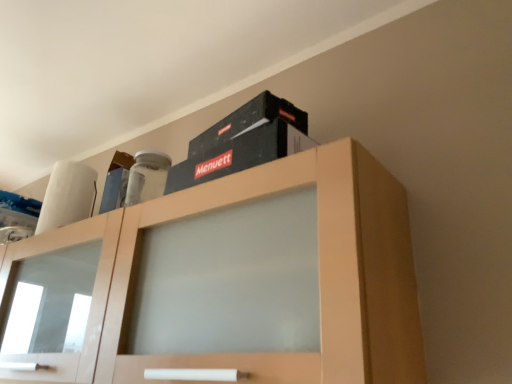
Where is `matte wood cabinet at upper center`? Image resolution: width=512 pixels, height=384 pixels. matte wood cabinet at upper center is located at coordinates (320, 262).

What do you see at coordinates (320, 262) in the screenshot? I see `matte wood cabinet at upper center` at bounding box center [320, 262].

This screenshot has height=384, width=512. Identify the location of matte wood cabinet at upper center. (320, 262).